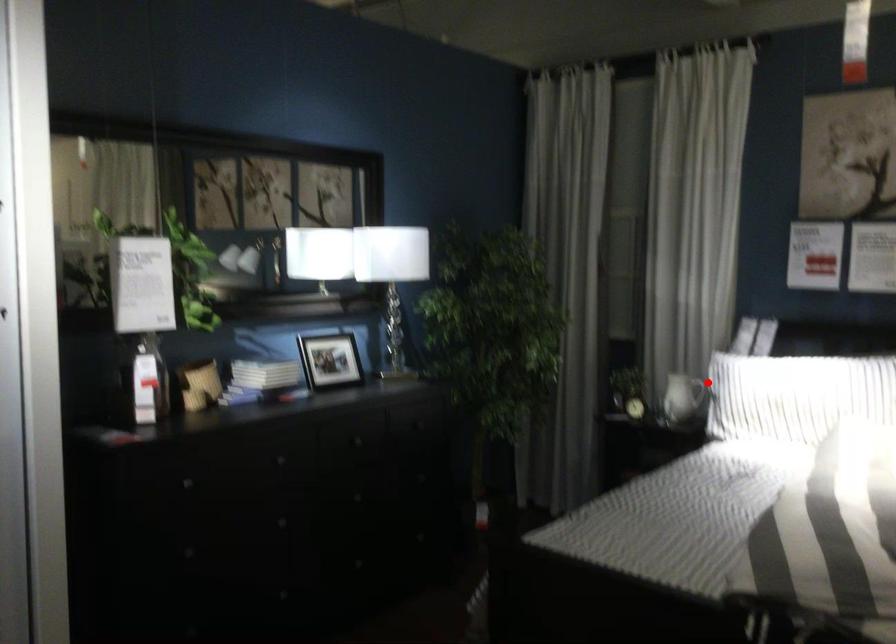
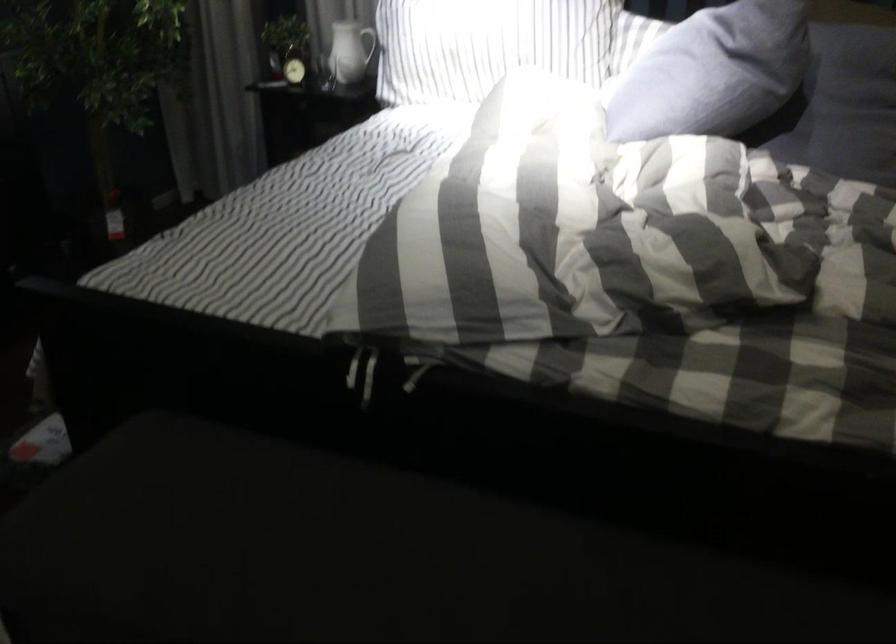
The point at the highlighted location is marked in the first image. Where is the corresponding point in the second image?

(371, 44)